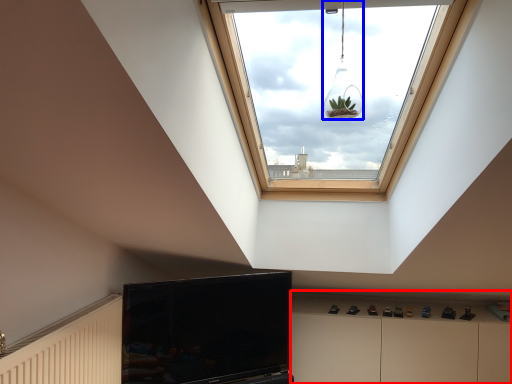
Question: Which object appears closest to the camera in this image, dresser (highlighted by a red box) or light fixture (highlighted by a blue box)?

Choices:
 (A) dresser
 (B) light fixture

Answer: (B)